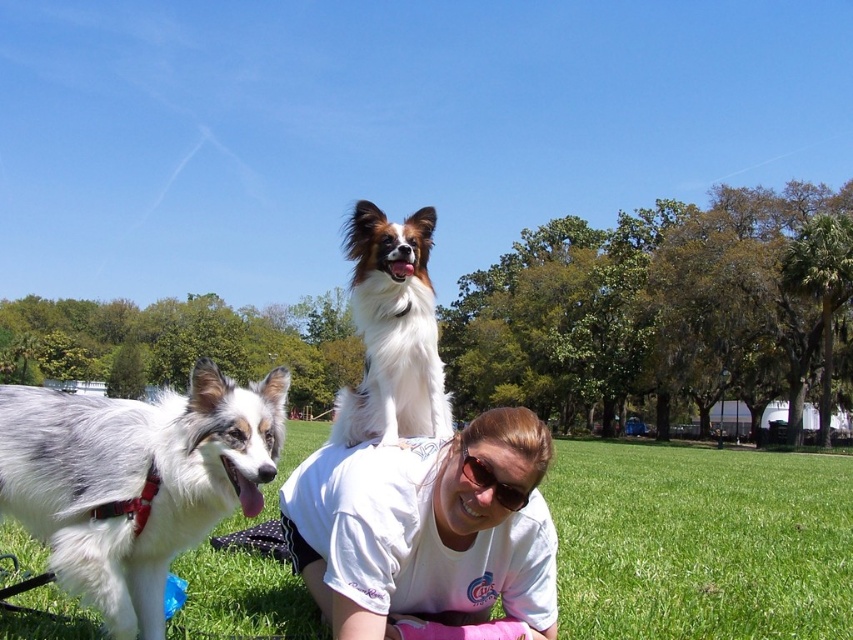
Question: Can you confirm if white t-shirt at center is thinner than white fluffy dog at center?

Choices:
 (A) yes
 (B) no

Answer: (A)

Question: In this image, where is white t-shirt at center located relative to sunglasses at center?

Choices:
 (A) above
 (B) below

Answer: (B)

Question: Which point is farther to the camera?

Choices:
 (A) (328, 544)
 (B) (519, 488)
 (C) (693, 634)

Answer: (C)

Question: Among these points, which one is farthest from the camera?

Choices:
 (A) (730, 577)
 (B) (527, 497)
 (C) (328, 580)

Answer: (A)

Question: Which of the following is the farthest from the observer?

Choices:
 (A) (173, 499)
 (B) (250, 586)
 (C) (370, 308)
 (D) (555, 566)

Answer: (B)

Question: Is green grass at lower center to the right of gray-white fur dog at left from the viewer's perspective?

Choices:
 (A) no
 (B) yes

Answer: (B)